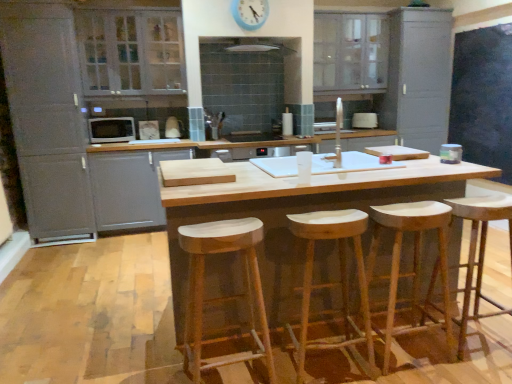
Question: Looking at their shapes, would you say white glossy toaster at center, acting as the 2th appliance starting from the left, is wider or thinner than blue plastic clock at upper center?

Choices:
 (A) thin
 (B) wide

Answer: (B)

Question: Is white glossy toaster at center, which is counted as the second appliance, starting from the front, bigger or smaller than blue plastic clock at upper center?

Choices:
 (A) big
 (B) small

Answer: (B)

Question: Which of these objects is positioned closest to the blue plastic clock at upper center?

Choices:
 (A) white glossy microwave at left, which is the 2th appliance from back to front
 (B) white glass cabinet at upper left, which is the second cabinetry from left to right
 (C) matte gray cabinet at upper right, placed as the first cabinetry when sorted from right to left
 (D) natural wood stool at center, arranged as the 1th stool when viewed from the right
 (E) natural wood bar stool at center

Answer: (B)

Question: Estimate the real-world distances between objects in this image. Which object is closer to the white glass cabinet at upper left, which is the second cabinetry from left to right?

Choices:
 (A) white glossy exhaust hood at upper center
 (B) natural wood stool at center, the second stool viewed from the left
 (C) natural wood bar stool at center
 (D) natural wood counter at center
 (E) natural wood stool at center, arranged as the 1th stool when viewed from the right

Answer: (A)